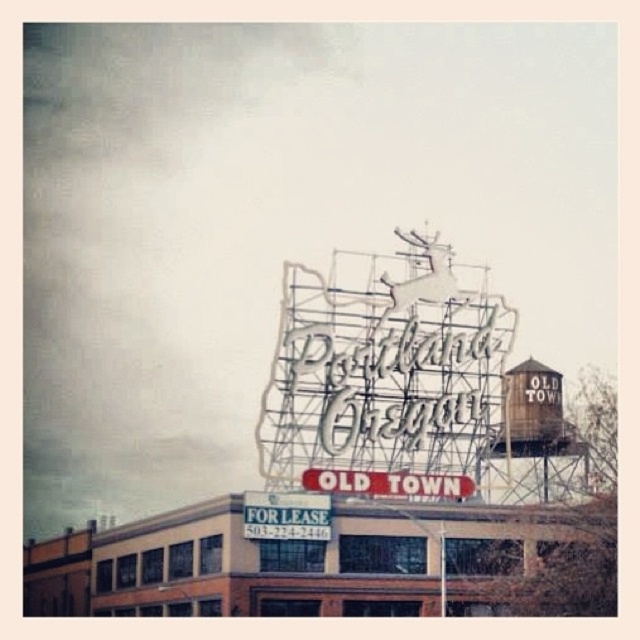
Question: Which of the following is the farthest from the observer?

Choices:
 (A) white metal sign at center
 (B) rustic wooden water tower at upper right
 (C) metallic wireframe sign at center

Answer: (B)

Question: Considering the relative positions of metallic wireframe sign at center and white metal sign at center in the image provided, where is metallic wireframe sign at center located with respect to white metal sign at center?

Choices:
 (A) left
 (B) right

Answer: (A)

Question: Which object appears closest to the camera in this image?

Choices:
 (A) white metal sign at center
 (B) rustic wooden water tower at upper right
 (C) metallic wireframe sign at center

Answer: (A)

Question: Does rustic wooden water tower at upper right have a lesser width compared to white metal sign at center?

Choices:
 (A) no
 (B) yes

Answer: (B)

Question: Is metallic wireframe sign at center bigger than white metal sign at center?

Choices:
 (A) no
 (B) yes

Answer: (B)

Question: Which object appears closest to the camera in this image?

Choices:
 (A) white metal sign at center
 (B) metallic wireframe sign at center

Answer: (A)